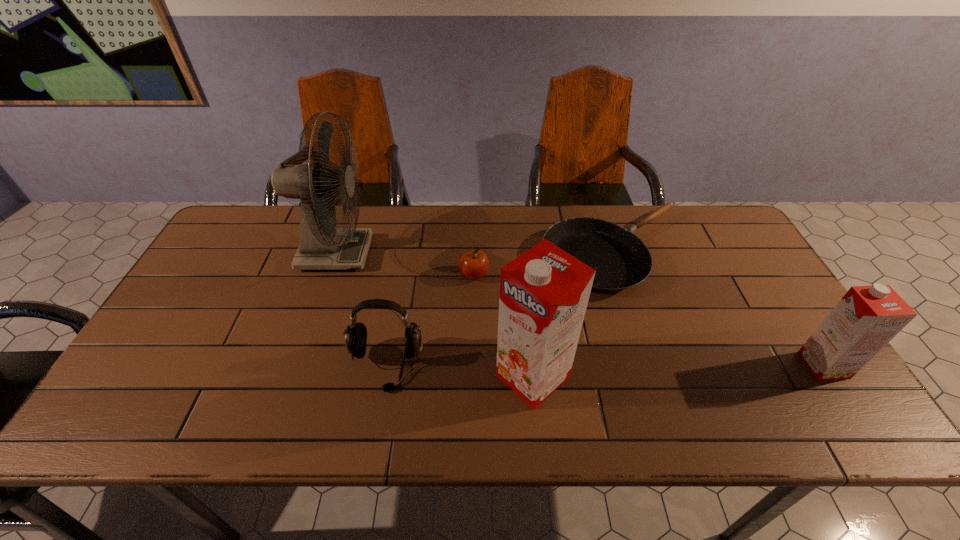
The width and height of the screenshot is (960, 540). I want to click on free spot at the far edge of the desktop, so click(520, 234).

This screenshot has width=960, height=540. What are the coordinates of `blank area at the near edge` in the screenshot? It's located at (444, 385).

Locate an element on the screen. vacant space at the right edge is located at coordinates (721, 293).

Where is `vacant position at the far left corner of the desktop`? vacant position at the far left corner of the desktop is located at coordinates (252, 237).

The height and width of the screenshot is (540, 960). What are the coordinates of `blank area at the near left corner` in the screenshot? It's located at (139, 381).

Identify the location of vacant region between the headset and the fifth tallest object. Image resolution: width=960 pixels, height=540 pixels. (430, 320).

Find the location of a particular element. free space between the headset and the fifth shortest object is located at coordinates point(459,371).

Identify the location of vacant area that lies between the fan and the taller carton. This screenshot has height=540, width=960. tap(434, 315).

Identify the location of free space between the taller carton and the fourth shortest object. (678, 370).

The image size is (960, 540). What are the coordinates of `free space between the fifth tallest object and the fourth shortest object` in the screenshot? It's located at (649, 320).